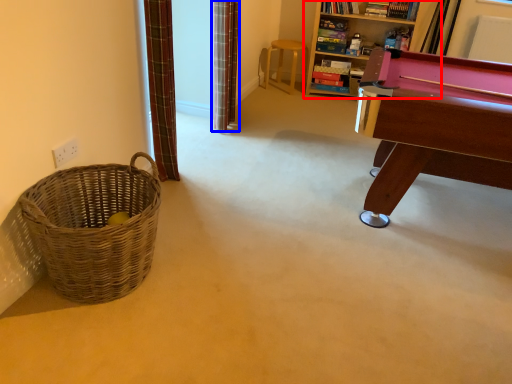
Question: Which object is closer to the camera taking this photo, bookcase (highlighted by a red box) or curtain (highlighted by a blue box)?

Choices:
 (A) bookcase
 (B) curtain

Answer: (B)